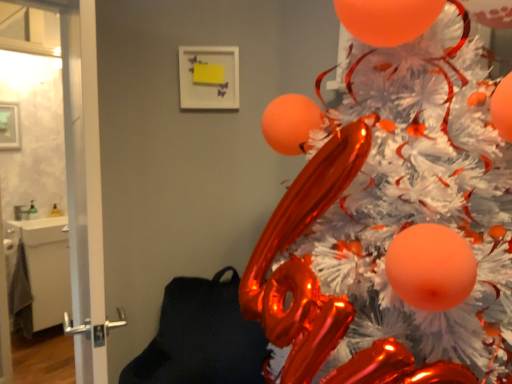
Question: Is white glossy door at left, positioned as the 1th screen door in left-to-right order, located outside transparent glass door at left, placed as the first screen door when sorted from right to left?

Choices:
 (A) no
 (B) yes

Answer: (B)

Question: Is white glossy door at left, positioned as the 1th screen door in left-to-right order, at the right side of transparent glass door at left, which is counted as the 2th screen door, starting from the left?

Choices:
 (A) yes
 (B) no

Answer: (B)

Question: Is white glossy door at left, positioned as the 1th screen door in left-to-right order, turned away from transparent glass door at left, placed as the first screen door when sorted from right to left?

Choices:
 (A) no
 (B) yes

Answer: (B)

Question: Is white glossy door at left, positioned as the 1th screen door in left-to-right order, in contact with transparent glass door at left, placed as the first screen door when sorted from right to left?

Choices:
 (A) no
 (B) yes

Answer: (B)

Question: From a real-world perspective, is white glossy door at left, marked as the 2th screen door in a right-to-left arrangement, under transparent glass door at left, which is counted as the 2th screen door, starting from the left?

Choices:
 (A) yes
 (B) no

Answer: (B)

Question: Is white glossy door at left, marked as the 2th screen door in a right-to-left arrangement, inside or outside of transparent glass door at left, which is counted as the 2th screen door, starting from the left?

Choices:
 (A) outside
 (B) inside

Answer: (A)

Question: Is white glossy door at left, marked as the 2th screen door in a right-to-left arrangement, bigger or smaller than transparent glass door at left, which is counted as the 2th screen door, starting from the left?

Choices:
 (A) big
 (B) small

Answer: (B)

Question: In the image, is white glossy door at left, positioned as the 1th screen door in left-to-right order, positioned in front of or behind transparent glass door at left, which is counted as the 2th screen door, starting from the left?

Choices:
 (A) behind
 (B) front

Answer: (A)

Question: From a real-world perspective, is white glossy door at left, marked as the 2th screen door in a right-to-left arrangement, physically located above or below transparent glass door at left, which is counted as the 2th screen door, starting from the left?

Choices:
 (A) above
 (B) below

Answer: (A)

Question: Considering the positions of white glossy door at left, positioned as the 1th screen door in left-to-right order, and shiny metallic christmas tree at upper right in the image, is white glossy door at left, positioned as the 1th screen door in left-to-right order, wider or thinner than shiny metallic christmas tree at upper right?

Choices:
 (A) thin
 (B) wide

Answer: (A)

Question: Looking at the image, does white glossy door at left, marked as the 2th screen door in a right-to-left arrangement, seem bigger or smaller compared to shiny metallic christmas tree at upper right?

Choices:
 (A) big
 (B) small

Answer: (B)

Question: Do you think white glossy door at left, positioned as the 1th screen door in left-to-right order, is within shiny metallic christmas tree at upper right, or outside of it?

Choices:
 (A) outside
 (B) inside

Answer: (A)

Question: Is white glossy door at left, marked as the 2th screen door in a right-to-left arrangement, taller or shorter than shiny metallic christmas tree at upper right?

Choices:
 (A) tall
 (B) short

Answer: (A)

Question: From the image's perspective, is transparent glass door at left, which is counted as the 2th screen door, starting from the left, above or below shiny metallic christmas tree at upper right?

Choices:
 (A) above
 (B) below

Answer: (A)

Question: Looking at their shapes, would you say transparent glass door at left, placed as the first screen door when sorted from right to left, is wider or thinner than shiny metallic christmas tree at upper right?

Choices:
 (A) wide
 (B) thin

Answer: (B)